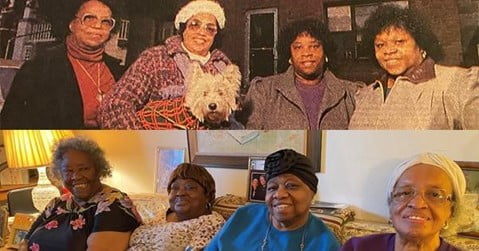
The image size is (479, 251). Identify the location of lamp. (x=43, y=192).